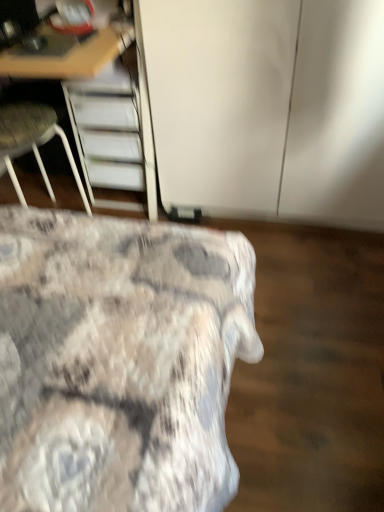
Question: Can we say textured fabric bed at lower left lies outside white fabric chair at left?

Choices:
 (A) no
 (B) yes

Answer: (B)

Question: From the image's perspective, is textured fabric bed at lower left below white fabric chair at left?

Choices:
 (A) no
 (B) yes

Answer: (B)

Question: Can you confirm if textured fabric bed at lower left is bigger than white fabric chair at left?

Choices:
 (A) yes
 (B) no

Answer: (A)

Question: From a real-world perspective, does textured fabric bed at lower left stand above white fabric chair at left?

Choices:
 (A) yes
 (B) no

Answer: (B)

Question: Does textured fabric bed at lower left appear on the right side of white fabric chair at left?

Choices:
 (A) no
 (B) yes

Answer: (B)

Question: Is white fabric chair at left at the back of textured fabric bed at lower left?

Choices:
 (A) yes
 (B) no

Answer: (B)

Question: Does textured fabric bed at lower left have a lesser width compared to white glossy cabinet at upper center?

Choices:
 (A) no
 (B) yes

Answer: (A)

Question: Can white glossy cabinet at upper center be found inside textured fabric bed at lower left?

Choices:
 (A) yes
 (B) no

Answer: (B)

Question: From the image's perspective, is textured fabric bed at lower left located above white glossy cabinet at upper center?

Choices:
 (A) no
 (B) yes

Answer: (A)

Question: Is textured fabric bed at lower left taller than white glossy cabinet at upper center?

Choices:
 (A) yes
 (B) no

Answer: (B)

Question: Is textured fabric bed at lower left not near white glossy cabinet at upper center?

Choices:
 (A) yes
 (B) no

Answer: (B)

Question: Is textured fabric bed at lower left behind white glossy cabinet at upper center?

Choices:
 (A) yes
 (B) no

Answer: (B)

Question: Is the position of wooden desk at upper left more distant than that of white glossy cabinet at upper center?

Choices:
 (A) no
 (B) yes

Answer: (A)